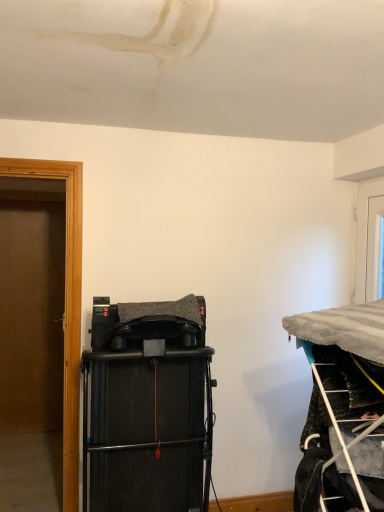
In order to click on white plastic ladder at lower right in this screenshot , I will do `click(340, 439)`.

What do you see at coordinates (148, 407) in the screenshot? I see `black matte speaker at center` at bounding box center [148, 407].

Identify the location of white plastic ladder at lower right. Image resolution: width=384 pixels, height=512 pixels. (340, 439).

Which point is more distant from viewer, [200,374] or [313,408]?

Point [200,374]

From the image's perspective, is black matte speaker at center below metallic wire rack at right?

Correct, black matte speaker at center appears lower than metallic wire rack at right in the image.

Based on their positions, is black matte speaker at center located to the left or right of metallic wire rack at right?

Based on their positions, black matte speaker at center is located to the left of metallic wire rack at right.

How different are the orientations of black matte speaker at center and metallic wire rack at right in degrees?

The angular difference between black matte speaker at center and metallic wire rack at right is 88.3 degrees.

What's the angular difference between white glossy door at upper right and metallic wire rack at right's facing directions?

The facing directions of white glossy door at upper right and metallic wire rack at right are 0.671 degrees apart.

Where is `door that is above the metallic wire rack at right (from the image's perspective)`? door that is above the metallic wire rack at right (from the image's perspective) is located at coordinates (364, 231).

Does white glossy door at upper right turn towards metallic wire rack at right?

No, white glossy door at upper right is not facing towards metallic wire rack at right.

From the image's perspective, is white glossy door at upper right positioned above or below metallic wire rack at right?

white glossy door at upper right is above metallic wire rack at right.

Is white glossy door at upper right not inside black matte speaker at center?

That's correct, white glossy door at upper right is outside of black matte speaker at center.

Are white glossy door at upper right and black matte speaker at center far apart?

Yes.

From the image's perspective, is white glossy door at upper right under black matte speaker at center?

Incorrect, from the image's perspective, white glossy door at upper right is higher than black matte speaker at center.

Looking at their sizes, would you say white glossy door at upper right is wider or thinner than black matte speaker at center?

white glossy door at upper right is thinner than black matte speaker at center.

Does point (100, 323) lie in front of point (363, 225)?

Yes, it is in front of point (363, 225).

Looking at this image, can you tell me how much black matte speaker at center and white glossy door at upper right differ in facing direction?

87.6 degrees.

From a real-world perspective, which is physically above, black matte speaker at center or white glossy door at upper right?

In real-world perspective, white glossy door at upper right is above.

In the image, there is a white glossy door at upper right. Identify the location of equipment below it (from the image's perspective). (148, 407).

Is black matte speaker at center in front of white plastic ladder at lower right?

No, black matte speaker at center is behind white plastic ladder at lower right.

Looking at this image, from a real-world perspective, relative to white plastic ladder at lower right, is black matte speaker at center vertically above or below?

black matte speaker at center is situated lower than white plastic ladder at lower right in the real world.

From the image's perspective, who appears lower, black matte speaker at center or white plastic ladder at lower right?

black matte speaker at center appears lower in the image.

Is black matte speaker at center positioned far away from white plastic ladder at lower right?

No, there isn't a large distance between black matte speaker at center and white plastic ladder at lower right.

Between metallic wire rack at right and black matte speaker at center, which one appears on the right side from the viewer's perspective?

Positioned to the right is metallic wire rack at right.

The image size is (384, 512). I want to click on equipment that appears on the left of metallic wire rack at right, so click(148, 407).

Looking at this image, is there a large distance between metallic wire rack at right and black matte speaker at center?

metallic wire rack at right is actually quite close to black matte speaker at center.

How many degrees apart are the facing directions of metallic wire rack at right and black matte speaker at center?

The facing directions of metallic wire rack at right and black matte speaker at center are 88.3 degrees apart.

In the scene shown: How much distance is there between white plastic ladder at lower right and metallic wire rack at right?

white plastic ladder at lower right and metallic wire rack at right are 3.68 inches apart.

Where is `furniture below the white plastic ladder at lower right (from a real-world perspective)`? The image size is (384, 512). furniture below the white plastic ladder at lower right (from a real-world perspective) is located at coordinates (342, 408).

Can you confirm if white plastic ladder at lower right is wider than metallic wire rack at right?

No, white plastic ladder at lower right is not wider than metallic wire rack at right.

Considering the sizes of objects white plastic ladder at lower right and metallic wire rack at right in the image provided, who is bigger, white plastic ladder at lower right or metallic wire rack at right?

metallic wire rack at right is bigger.

In order to click on furniture on the right of black matte speaker at center in this screenshot , I will do `click(342, 408)`.

Locate an element on the screen. This screenshot has width=384, height=512. door above the metallic wire rack at right (from the image's perspective) is located at coordinates (364, 231).

From the image, which object appears to be farther from white plastic ladder at lower right, black matte speaker at center or metallic wire rack at right?

black matte speaker at center is further to white plastic ladder at lower right.

Considering their positions, is white plastic ladder at lower right positioned closer to black matte speaker at center than white glossy door at upper right?

white plastic ladder at lower right.

Estimate the real-world distances between objects in this image. Which object is further from white glossy door at upper right, metallic wire rack at right or white plastic ladder at lower right?

Based on the image, white plastic ladder at lower right appears to be further to white glossy door at upper right.

Estimate the real-world distances between objects in this image. Which object is further from metallic wire rack at right, black matte speaker at center or white plastic ladder at lower right?

black matte speaker at center.

Looking at the image, which one is located closer to black matte speaker at center, white plastic ladder at lower right or metallic wire rack at right?

metallic wire rack at right is positioned closer to the anchor black matte speaker at center.

From the image, which object appears to be farther from white glossy door at upper right, white plastic ladder at lower right or black matte speaker at center?

black matte speaker at center lies further to white glossy door at upper right than the other object.

From the image, which object appears to be nearer to white plastic ladder at lower right, white glossy door at upper right or metallic wire rack at right?

The object closer to white plastic ladder at lower right is metallic wire rack at right.

Considering their positions, is white glossy door at upper right positioned closer to metallic wire rack at right than white plastic ladder at lower right?

Based on the image, white plastic ladder at lower right appears to be nearer to metallic wire rack at right.

Identify the location of ladder between black matte speaker at center and white glossy door at upper right. The height and width of the screenshot is (512, 384). (340, 439).

The height and width of the screenshot is (512, 384). Identify the location of furniture between white plastic ladder at lower right and white glossy door at upper right along the z-axis. (342, 408).

Locate an element on the screen. This screenshot has width=384, height=512. furniture situated between black matte speaker at center and white glossy door at upper right from left to right is located at coordinates point(342,408).

Identify the location of furniture between black matte speaker at center and white plastic ladder at lower right in the horizontal direction. (342, 408).